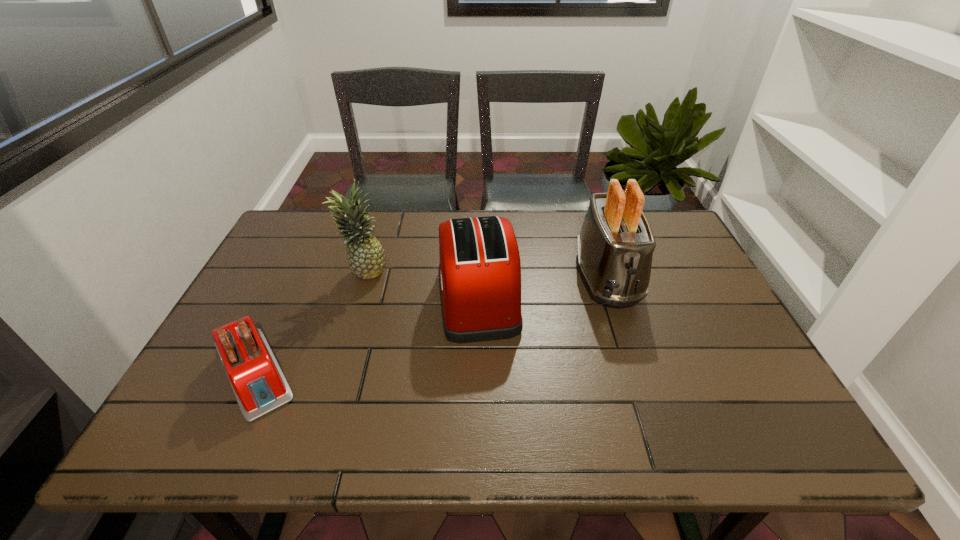
Locate an element on the screen. The height and width of the screenshot is (540, 960). free space at the near right corner of the desktop is located at coordinates tap(740, 450).

I want to click on free space between the pineapple and the leftmost object, so click(309, 323).

Locate an element on the screen. The image size is (960, 540). free spot between the leftmost toaster and the rightmost toaster is located at coordinates (431, 325).

Identify the location of free space between the second object from right to left and the second object from left to right. The height and width of the screenshot is (540, 960). (421, 286).

Where is `vacant space that is in between the shortest toaster and the second object from left to right`? The width and height of the screenshot is (960, 540). vacant space that is in between the shortest toaster and the second object from left to right is located at coordinates (309, 323).

Identify the location of free space between the leftmost toaster and the rightmost toaster. The height and width of the screenshot is (540, 960). (431, 325).

The width and height of the screenshot is (960, 540). Identify the location of free space that is in between the third tallest object and the shortest object. (367, 336).

Find the location of a particular element. This screenshot has width=960, height=540. free spot between the shortest toaster and the rightmost toaster is located at coordinates (431, 325).

Where is `free space between the second object from right to left and the tallest toaster`? free space between the second object from right to left and the tallest toaster is located at coordinates (542, 288).

Point out which object is positioned as the nearest to the rightmost object. Please provide its 2D coordinates. Your answer should be formatted as a tuple, i.e. [(x, y)], where the tuple contains the x and y coordinates of a point satisfying the conditions above.

[(479, 272)]